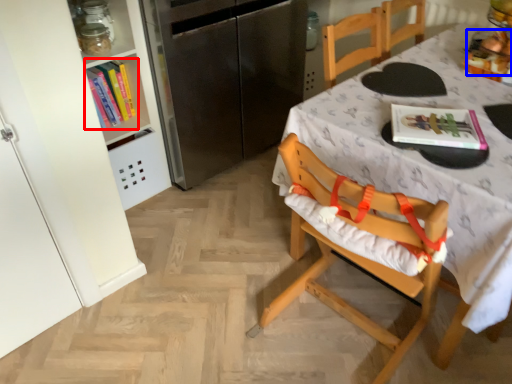
Question: Which object appears farthest to the camera in this image, book (highlighted by a red box) or food (highlighted by a blue box)?

Choices:
 (A) book
 (B) food

Answer: (A)